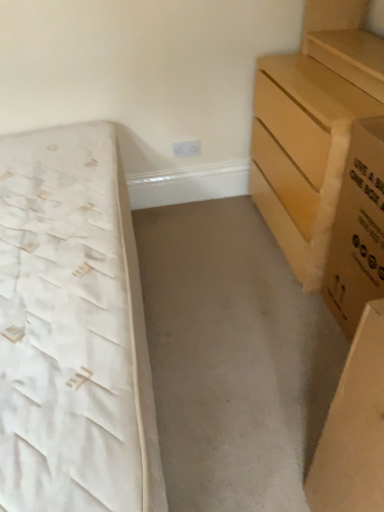
Question: Choose the correct answer: Is brown cardboard box at right inside white fabric bed at left or outside it?

Choices:
 (A) inside
 (B) outside

Answer: (B)

Question: Relative to white fabric bed at left, is brown cardboard box at right in front or behind?

Choices:
 (A) behind
 (B) front

Answer: (A)

Question: Which object is positioned closest to the brown cardboard box at right?

Choices:
 (A) light brown wooden chest of drawers at right
 (B) white fabric bed at left

Answer: (A)

Question: Which is farther from the light brown wooden chest of drawers at right?

Choices:
 (A) white fabric bed at left
 (B) brown cardboard box at right

Answer: (A)